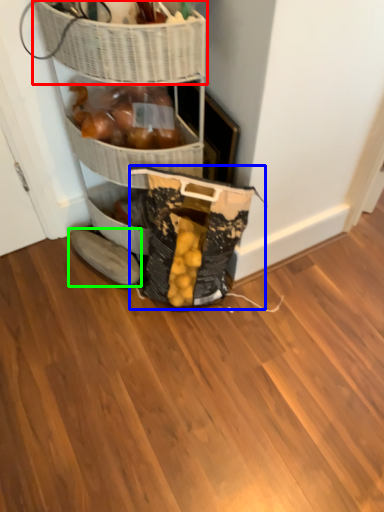
Question: Estimate the real-world distances between objects in this image. Which object is farther from basket (highlighted by a red box), material (highlighted by a blue box) or footwear (highlighted by a green box)?

Choices:
 (A) material
 (B) footwear

Answer: (B)